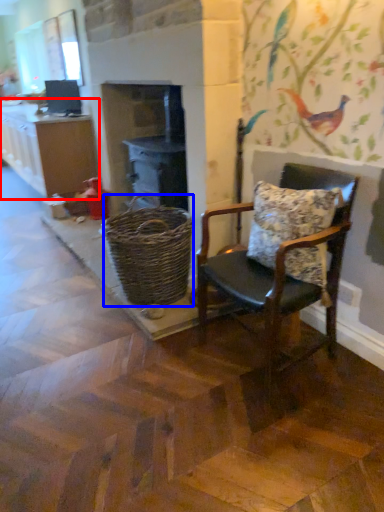
Question: Which of the following is the closest to the observer, cabinetry (highlighted by a red box) or basket (highlighted by a blue box)?

Choices:
 (A) cabinetry
 (B) basket

Answer: (B)